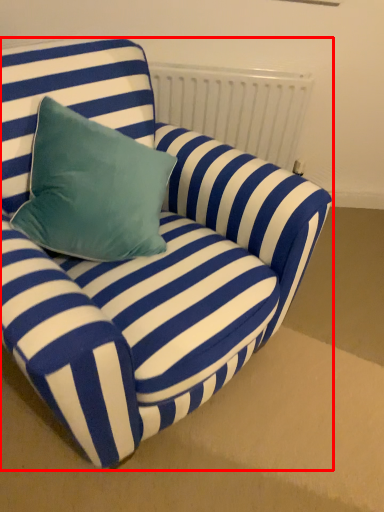
Question: From the image's perspective, where is studio couch (annotated by the red box) located in relation to radiator in the image?

Choices:
 (A) below
 (B) above

Answer: (A)